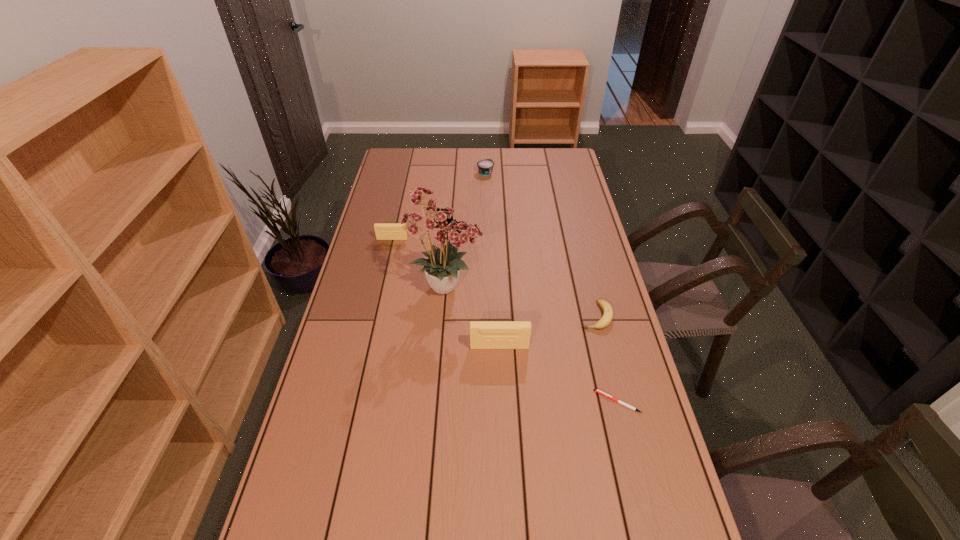
Image resolution: width=960 pixels, height=540 pixels. Identify the location of vacant place for an extra videotape on the right. (689, 537).